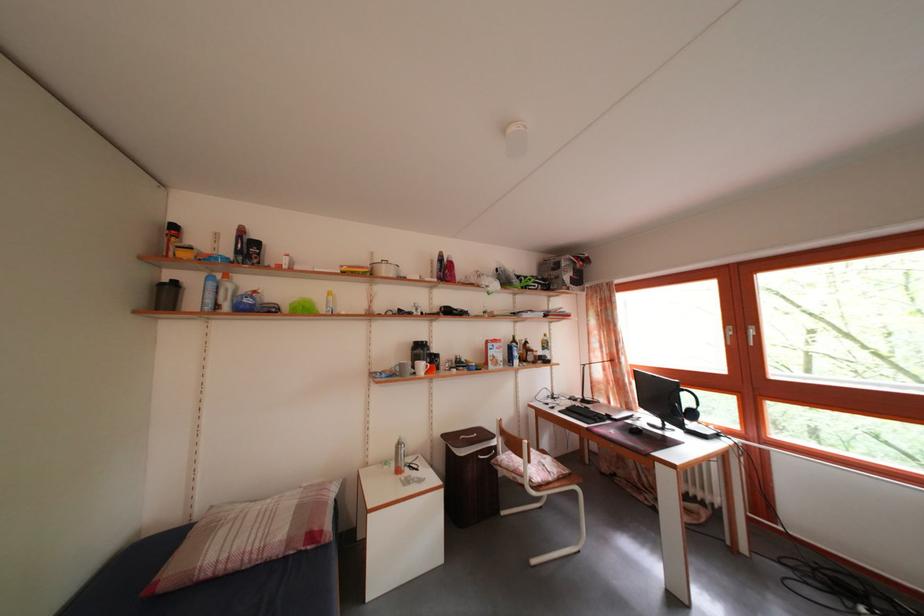
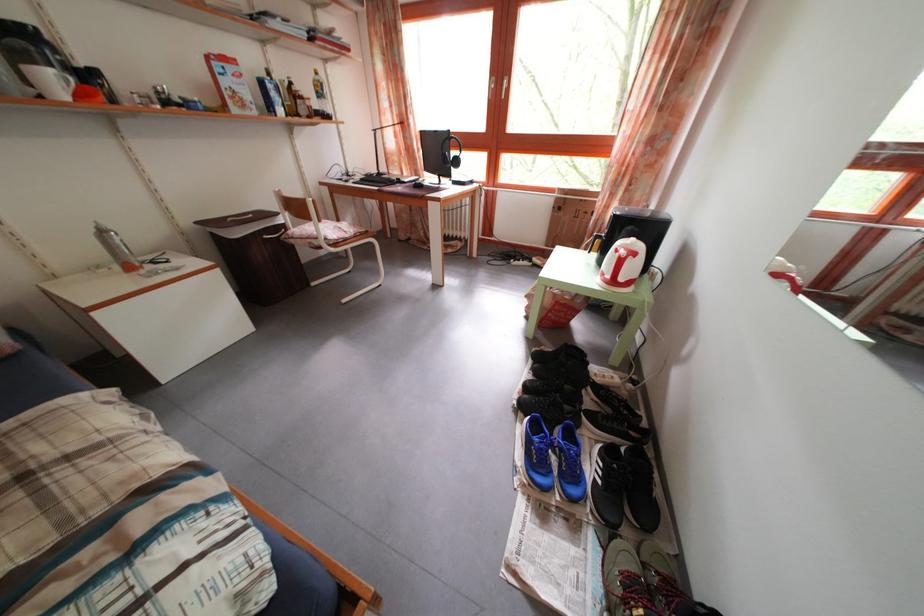
The first image is from the beginning of the video and the second image is from the end. How did the camera likely rotate when shooting the video?

The camera's rotation is toward right-down.